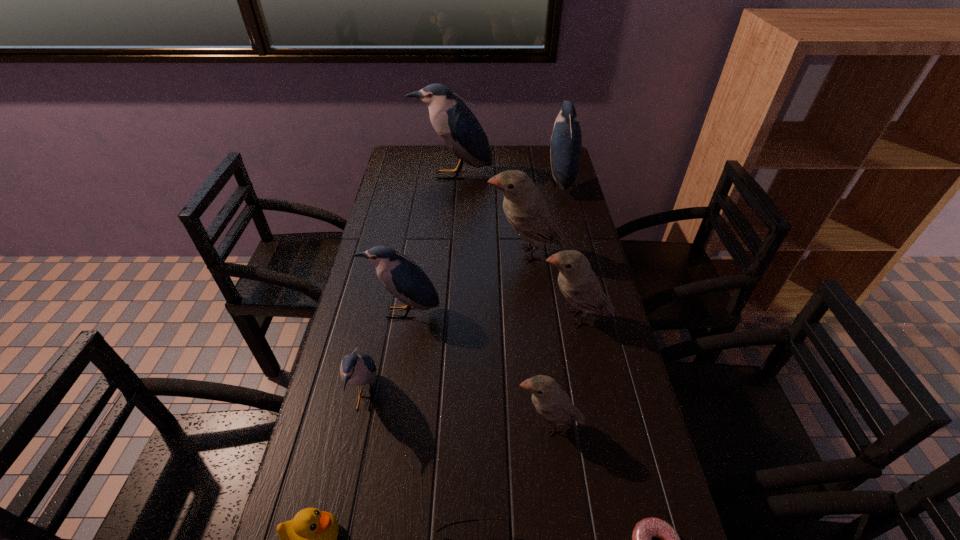
In order to click on vacant space located at the tip of the rightmost blue bird's beak in this screenshot , I will do `click(503, 181)`.

The image size is (960, 540). In order to click on free point located 0.190m at the tip of the rightmost blue bird's beak in this screenshot , I will do `click(498, 181)`.

This screenshot has height=540, width=960. I want to click on vacant area situated 0.060m at the tip of the rightmost blue bird's beak, so click(x=531, y=181).

Identify the location of vacant space located 0.050m at the face of the fifth nearest bird. The width and height of the screenshot is (960, 540). (470, 253).

Locate an element on the screen. Image resolution: width=960 pixels, height=540 pixels. vacant space located 0.200m at the face of the fifth nearest bird is located at coordinates (424, 253).

You are a GUI agent. You are given a task and a screenshot of the screen. Output one action in this format:
    pyautogui.click(x=<x>, y=<y>)
    Task: Click on the free space located at the face of the fifth nearest bird
    Image resolution: width=960 pixels, height=540 pixels.
    Given the screenshot: What is the action you would take?
    pyautogui.click(x=419, y=253)

You are a GUI agent. You are given a task and a screenshot of the screen. Output one action in this format:
    pyautogui.click(x=<x>, y=<y>)
    Task: Click on the free space located 0.250m at the face of the second smallest white bird
    The width and height of the screenshot is (960, 540).
    Given the screenshot: What is the action you would take?
    pyautogui.click(x=448, y=318)

Find the location of `free location located 0.080m at the face of the second smallest white bird`. free location located 0.080m at the face of the second smallest white bird is located at coordinates (510, 318).

Locate an element on the screen. vacant space located at the face of the second smallest white bird is located at coordinates (516, 318).

Find the location of a particular element. The height and width of the screenshot is (540, 960). blank area located at the tip of the second nearest blue bird's beak is located at coordinates (378, 462).